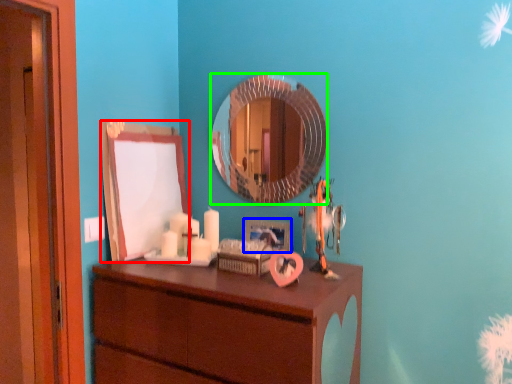
Question: Which is farther away from mirror (highlighted by a red box)? picture frame (highlighted by a blue box) or mirror (highlighted by a green box)?

Choices:
 (A) picture frame
 (B) mirror

Answer: (A)